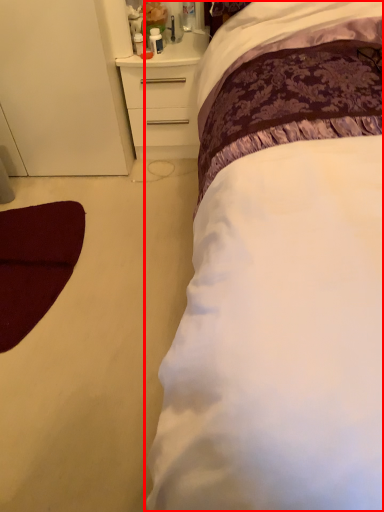
Question: Considering the relative positions of bed (annotated by the red box) and chest of drawers in the image provided, where is bed (annotated by the red box) located with respect to the staircase?

Choices:
 (A) right
 (B) left

Answer: (A)